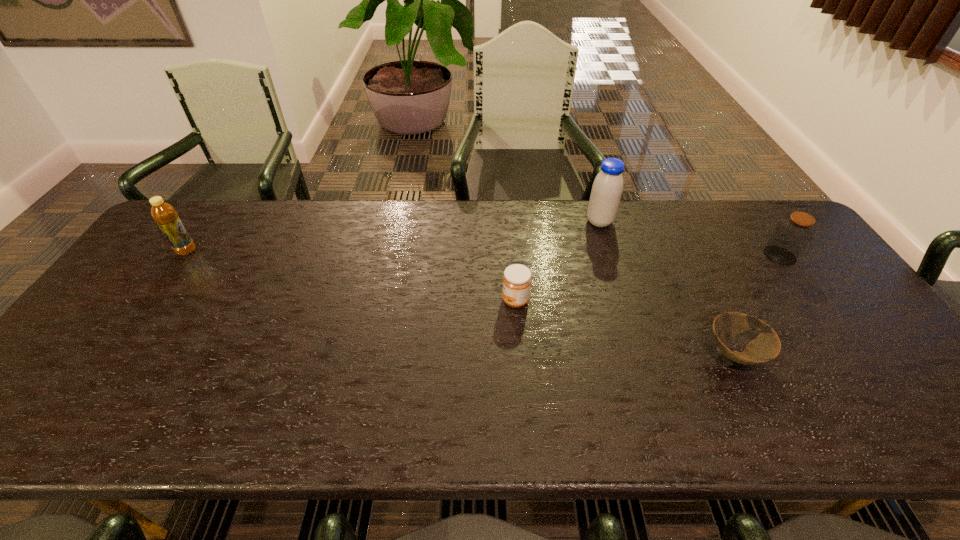
Locate an element on the screen. This screenshot has height=540, width=960. free space between the jam and the fourth shortest object is located at coordinates (351, 276).

This screenshot has width=960, height=540. What are the coordinates of `free area in between the fourth object from left to right and the farthest object` in the screenshot? It's located at 667,288.

Identify the location of free spot between the nearest object and the rightmost object. (757, 305).

The image size is (960, 540). Identify the location of vacant space that is in between the third object from left to right and the fourth tallest object. (558, 261).

Find the location of `free space between the rightmost object and the fourth tallest object`. free space between the rightmost object and the fourth tallest object is located at coordinates (648, 278).

This screenshot has width=960, height=540. Find the location of `unoccupied position between the fourth farthest object and the rightmost object`. unoccupied position between the fourth farthest object and the rightmost object is located at coordinates (648, 278).

Where is `vacant area between the third object from left to right and the fourth object from right to left`? vacant area between the third object from left to right and the fourth object from right to left is located at coordinates (558, 261).

At what (x,y) coordinates should I click in order to perform the action: click on free space between the fourth farthest object and the bottle. Please return your answer as a coordinate pair (x, y). Looking at the image, I should click on (351, 276).

Locate an element on the screen. The height and width of the screenshot is (540, 960). empty space between the farthest object and the second object from left to right is located at coordinates (558, 261).

Locate which object ranks fourth in proximity to the fourth object from right to left. Please provide its 2D coordinates. Your answer should be formatted as a tuple, i.e. [(x, y)], where the tuple contains the x and y coordinates of a point satisfying the conditions above.

[(164, 214)]